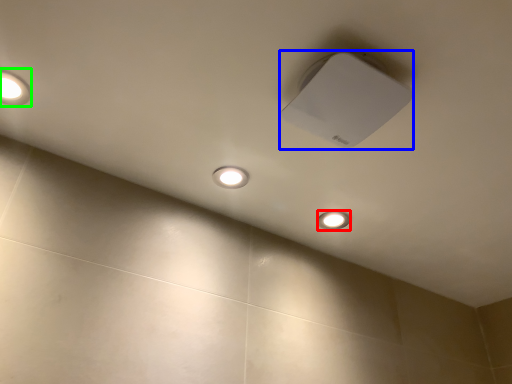
Question: Considering the real-world distances, which object is farthest from dot (highlighted by a red box)? lamp (highlighted by a blue box) or lamp (highlighted by a green box)?

Choices:
 (A) lamp
 (B) lamp

Answer: (B)